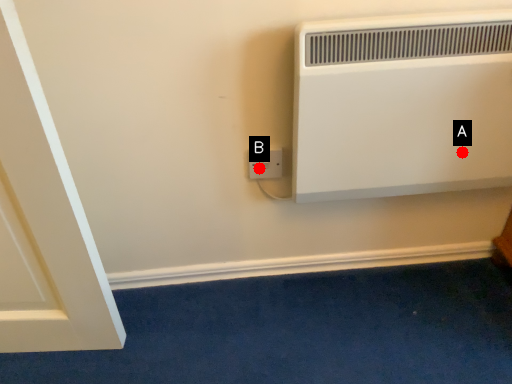
Question: Two points are circled on the image, labeled by A and B beside each circle. Which point appears closest to the camera in this image?

Choices:
 (A) A is closer
 (B) B is closer

Answer: (A)